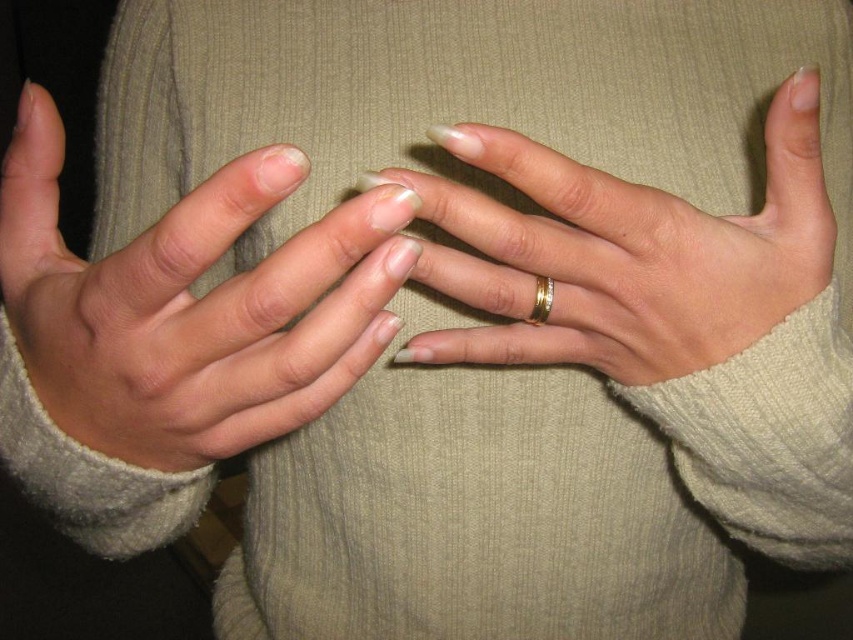
Who is positioned more to the right, matte gold ring at center or gold shiny ring at center?

gold shiny ring at center

Between matte gold ring at center and gold shiny ring at center, which one has more height?

matte gold ring at center is taller.

Does point (369, 336) come in front of point (543, 308)?

Yes, it is.

The width and height of the screenshot is (853, 640). What are the coordinates of `matte gold ring at center` in the screenshot? It's located at (193, 307).

Looking at this image, is the position of matte gold ring at center less distant than that of gold metallic ring at center?

Yes, matte gold ring at center is closer to the viewer.

What are the coordinates of `matte gold ring at center` in the screenshot? It's located at (193, 307).

Locate an element on the screen. Image resolution: width=853 pixels, height=640 pixels. matte gold ring at center is located at coordinates (193, 307).

In the scene shown: Who is positioned more to the right, gold metallic ring at center or gold shiny ring at center?

Positioned to the right is gold metallic ring at center.

Consider the image. Is the position of gold metallic ring at center less distant than that of gold shiny ring at center?

Yes, it is in front of gold shiny ring at center.

Describe the element at coordinates (619, 253) in the screenshot. I see `gold metallic ring at center` at that location.

This screenshot has width=853, height=640. I want to click on gold metallic ring at center, so click(x=619, y=253).